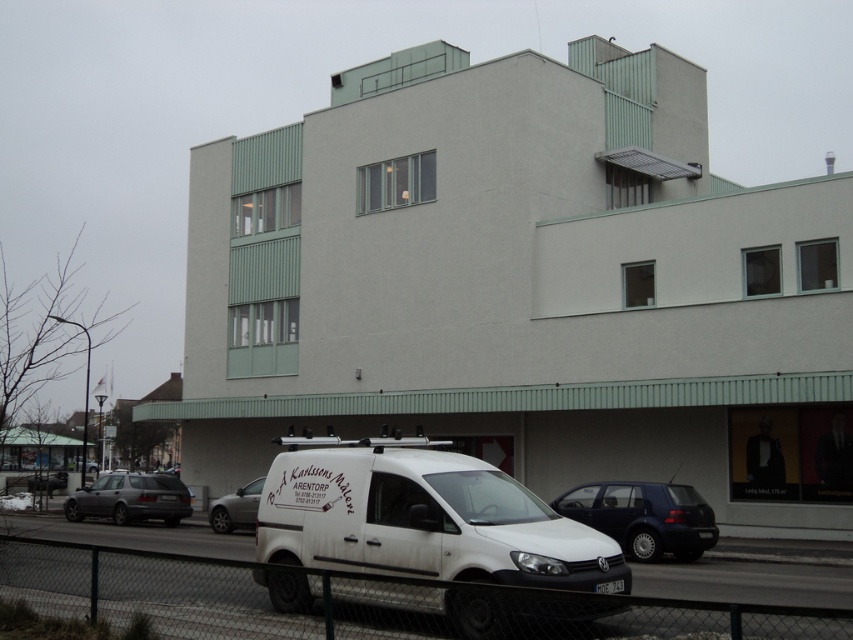
Between white matte van at lower center and dark blue matte car at center, which one appears on the left side from the viewer's perspective?

white matte van at lower center

Can you confirm if white matte van at lower center is thinner than dark blue matte car at center?

In fact, white matte van at lower center might be wider than dark blue matte car at center.

You are a GUI agent. You are given a task and a screenshot of the screen. Output one action in this format:
    pyautogui.click(x=<x>, y=<y>)
    Task: Click on the white matte van at lower center
    The width and height of the screenshot is (853, 640).
    Given the screenshot: What is the action you would take?
    pyautogui.click(x=422, y=516)

Describe the element at coordinates (131, 499) in the screenshot. I see `matte gray station wagon at lower left` at that location.

From the picture: Is matte gray station wagon at lower left smaller than silver metallic car at center?

Incorrect, matte gray station wagon at lower left is not smaller in size than silver metallic car at center.

Between point (160, 497) and point (247, 496), which one is positioned in front?

Positioned in front is point (247, 496).

This screenshot has height=640, width=853. I want to click on matte gray station wagon at lower left, so click(131, 499).

Can you confirm if dark blue matte car at center is positioned to the left of silver metallic car at center?

No, dark blue matte car at center is not to the left of silver metallic car at center.

Is dark blue matte car at center above silver metallic car at center?

Yes.

Who is more distant from viewer, (695, 515) or (216, 513)?

Point (216, 513)

This screenshot has height=640, width=853. I want to click on dark blue matte car at center, so [643, 516].